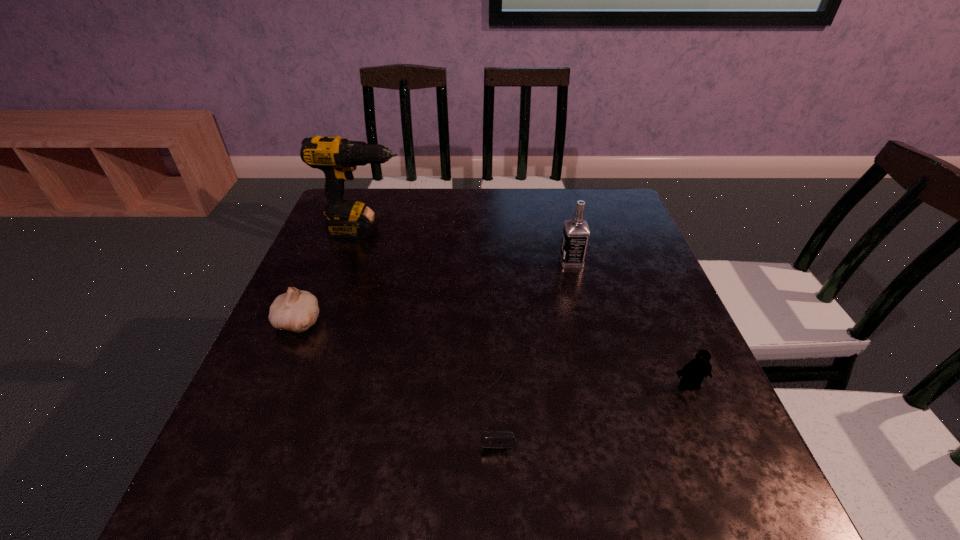
Locate an element on the screen. free space located 0.050m on the front label of the second tallest object is located at coordinates (541, 261).

You are a GUI agent. You are given a task and a screenshot of the screen. Output one action in this format:
    pyautogui.click(x=<x>, y=<y>)
    Task: Click on the free space located on the front label of the second tallest object
    The height and width of the screenshot is (540, 960).
    Given the screenshot: What is the action you would take?
    pyautogui.click(x=449, y=261)

You are a GUI agent. You are given a task and a screenshot of the screen. Output one action in this format:
    pyautogui.click(x=<x>, y=<y>)
    Task: Click on the vacant space positioned 0.210m on the right of the garlic
    
    Given the screenshot: What is the action you would take?
    pyautogui.click(x=416, y=322)

Find the location of `vacant space located 0.170m on the face of the rightmost object`. vacant space located 0.170m on the face of the rightmost object is located at coordinates (729, 477).

The height and width of the screenshot is (540, 960). Identify the location of vacant space situated 0.060m on the front-facing side of the webcam. [x=494, y=488].

Locate an element on the screen. The height and width of the screenshot is (540, 960). object that is at the far edge is located at coordinates (337, 157).

You are a GUI agent. You are given a task and a screenshot of the screen. Output one action in this format:
    pyautogui.click(x=<x>, y=<y>)
    Task: Click on the drill at the left edge
    
    Given the screenshot: What is the action you would take?
    pyautogui.click(x=337, y=157)

Locate an element on the screen. garlic located at the left edge is located at coordinates (297, 310).

Identify the location of object present at the right edge. Image resolution: width=960 pixels, height=540 pixels. (693, 373).

I want to click on object located at the far left corner, so click(x=337, y=157).